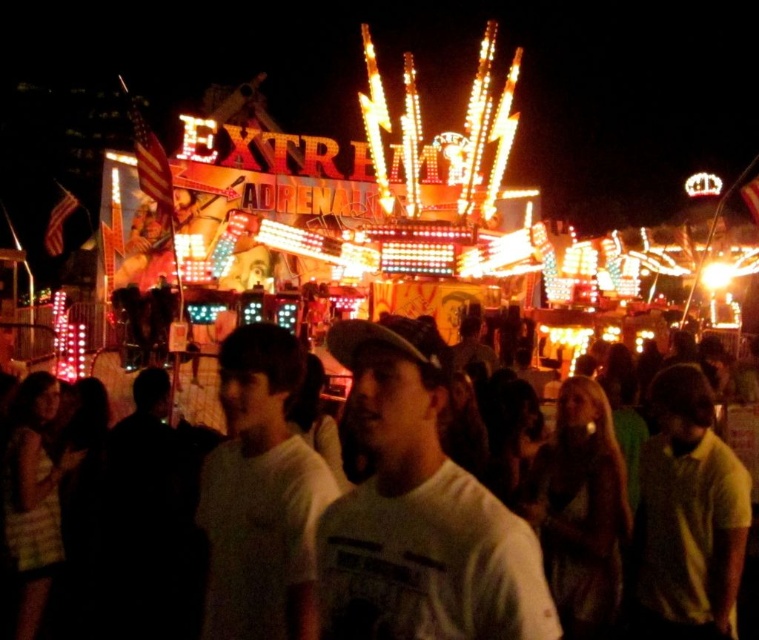
Question: Can you confirm if white matte shirt at center is positioned above white cotton shirt at center?

Choices:
 (A) yes
 (B) no

Answer: (B)

Question: In this image, where is white matte shirt at center located relative to white cotton shirt at center?

Choices:
 (A) left
 (B) right

Answer: (B)

Question: Is white matte shirt at center below white cotton shirt at center?

Choices:
 (A) no
 (B) yes

Answer: (B)

Question: Which of the following is the farthest from the observer?

Choices:
 (A) (337, 346)
 (B) (345, 515)

Answer: (A)

Question: Which point appears closest to the camera in this image?

Choices:
 (A) (735, 490)
 (B) (435, 570)

Answer: (B)